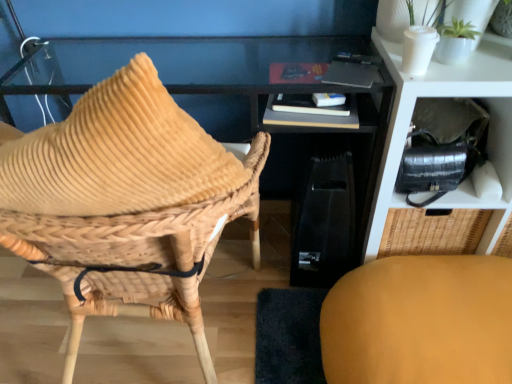
Question: Is matte yellow cushion at lower right, positioned as the 2th chair in left-to-right order, bigger or smaller than matte black shelf at upper right?

Choices:
 (A) small
 (B) big

Answer: (A)

Question: Is point click(364, 331) positioned closer to the camera than point click(381, 38)?

Choices:
 (A) closer
 (B) farther

Answer: (A)

Question: Which object is the farthest from the matte black shelf at upper right?

Choices:
 (A) hardcover book at center
 (B) matte yellow cushion at lower right, the first chair when ordered from right to left
 (C) woven wood chair at left, which is the second chair from right to left

Answer: (C)

Question: Based on their relative distances, which object is nearer to the woven wood chair at left, arranged as the first chair when viewed from the left?

Choices:
 (A) hardcover book at center
 (B) matte yellow cushion at lower right, positioned as the 2th chair in left-to-right order
 (C) matte black shelf at upper right

Answer: (A)